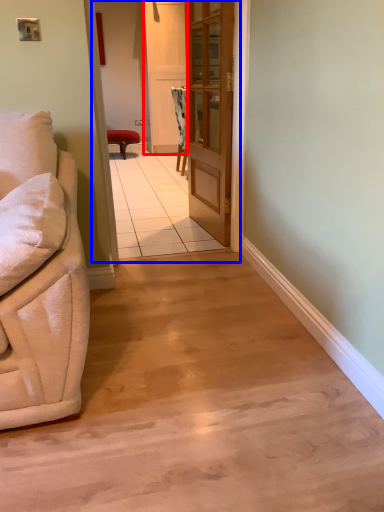
Question: Which point is closer to the camera, screen door (highlighted by a red box) or corridor (highlighted by a blue box)?

Choices:
 (A) screen door
 (B) corridor

Answer: (B)